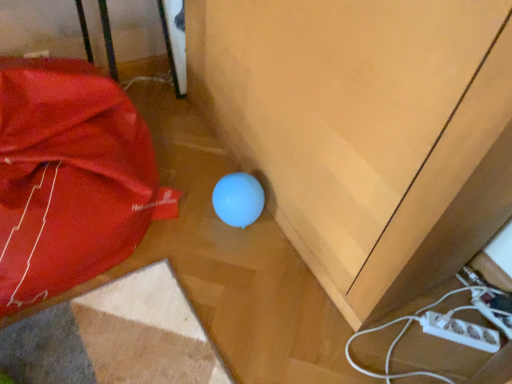
Where is `unoccupied region to the right of matte red umbrella at lower left`? The height and width of the screenshot is (384, 512). unoccupied region to the right of matte red umbrella at lower left is located at coordinates (217, 256).